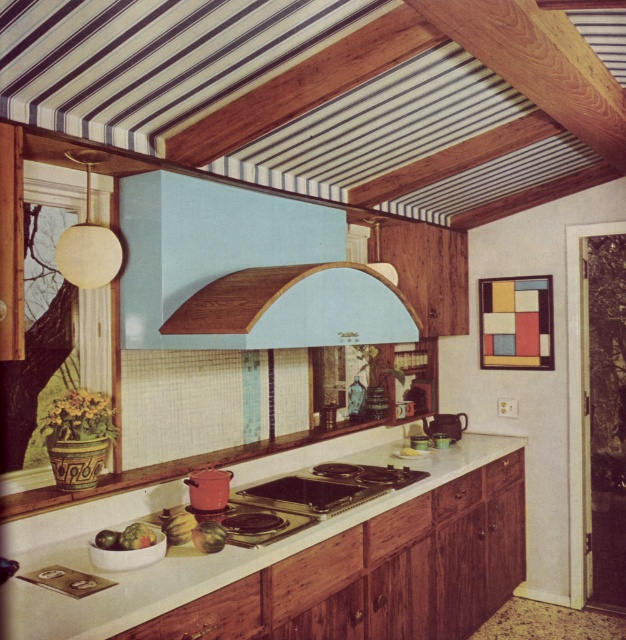
You are a chef preparing to place a large baking tray on the counter between the light blue wood exhaust hood at center and the shiny silver stove at center. Based on their widths, which appliance should you place the tray closer to to ensure it doesn not extend beyond the counter edges?

The light blue wood exhaust hood at center is wider than the shiny silver stove at center, so placing the tray closer to the hood would utilize the wider space effectively without overhanging the counter edges.